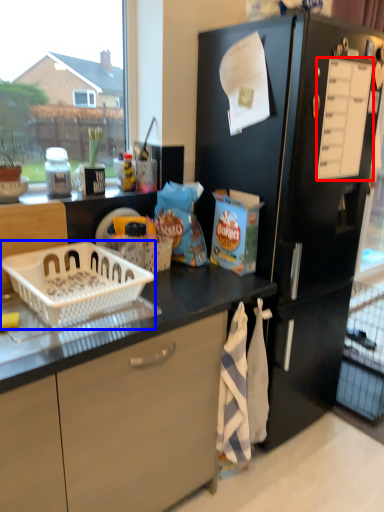
Question: Which object appears farthest to the camera in this image, drawer (highlighted by a red box) or basket (highlighted by a blue box)?

Choices:
 (A) drawer
 (B) basket

Answer: (A)